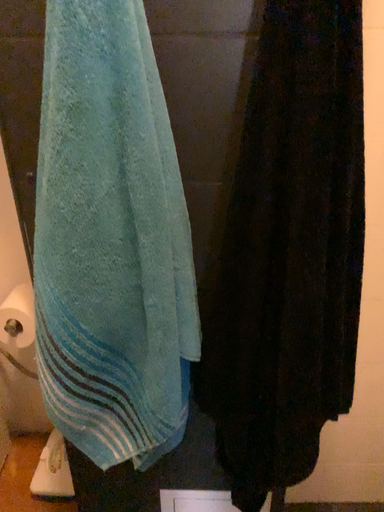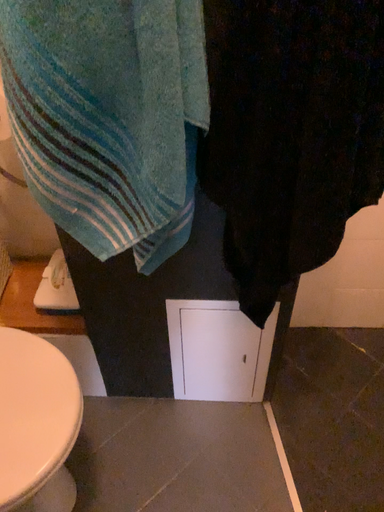
Question: Which way did the camera rotate in the video?

Choices:
 (A) rotated downward
 (B) rotated upward

Answer: (A)